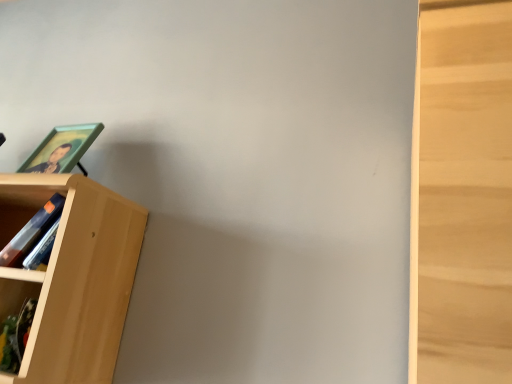
Identify the location of light wood bookcase at left. (72, 277).

This screenshot has height=384, width=512. Describe the element at coordinates (72, 277) in the screenshot. I see `light wood bookcase at left` at that location.

What do you see at coordinates (62, 149) in the screenshot? Image resolution: width=512 pixels, height=384 pixels. I see `matte green picture frame at left` at bounding box center [62, 149].

The width and height of the screenshot is (512, 384). Identify the location of matte green picture frame at left. (62, 149).

What is the approximate height of matte green picture frame at left?

18.96 centimeters.

You are a GUI agent. You are given a task and a screenshot of the screen. Output one action in this format:
    pyautogui.click(x=<x>, y=<y>)
    Task: Click on the light wood bookcase at left
    The image size is (512, 384).
    Given the screenshot: What is the action you would take?
    pyautogui.click(x=72, y=277)

Which object is positioned more to the right, light wood bookcase at left or matte green picture frame at left?

Positioned to the right is matte green picture frame at left.

Is light wood bookcase at left further to camera compared to matte green picture frame at left?

No.

Does point (106, 345) appear closer or farther from the camera than point (57, 151)?

Clearly, point (106, 345) is closer to the camera than point (57, 151).

From the image's perspective, which object appears higher, light wood bookcase at left or matte green picture frame at left?

From the image's view, matte green picture frame at left is above.

Consider the image. From a real-world perspective, is light wood bookcase at left positioned over matte green picture frame at left based on gravity?

Actually, light wood bookcase at left is physically below matte green picture frame at left in the real world.

Does light wood bookcase at left have a lesser width compared to matte green picture frame at left?

No, light wood bookcase at left is not thinner than matte green picture frame at left.

Between light wood bookcase at left and matte green picture frame at left, which one has more height?

light wood bookcase at left is taller.

Based on the photo, which of these two, light wood bookcase at left or matte green picture frame at left, is bigger?

With larger size is light wood bookcase at left.

Is light wood bookcase at left spatially inside matte green picture frame at left, or outside of it?

light wood bookcase at left is not enclosed by matte green picture frame at left.

Is light wood bookcase at left positioned far away from matte green picture frame at left?

Actually, light wood bookcase at left and matte green picture frame at left are a little close together.

Is light wood bookcase at left oriented towards matte green picture frame at left?

No.

What's the angular difference between light wood bookcase at left and matte green picture frame at left's facing directions?

2.75e-05 degrees.

How far apart are light wood bookcase at left and matte green picture frame at left?

light wood bookcase at left and matte green picture frame at left are 22.15 centimeters apart.

Where is `bookcase below the matte green picture frame at left (from the image's perspective)`? This screenshot has height=384, width=512. bookcase below the matte green picture frame at left (from the image's perspective) is located at coordinates (72, 277).

Which object is positioned more to the right, matte green picture frame at left or light wood bookcase at left?

matte green picture frame at left.

Considering their positions, is matte green picture frame at left located in front of or behind light wood bookcase at left?

In the image, matte green picture frame at left appears behind light wood bookcase at left.

Which is in front, point (66, 139) or point (96, 214)?

The point (96, 214) is more forward.

From the image's perspective, does matte green picture frame at left appear higher than light wood bookcase at left?

Correct, matte green picture frame at left appears higher than light wood bookcase at left in the image.

From a real-world perspective, is matte green picture frame at left physically above light wood bookcase at left?

Yes, from a real-world perspective, matte green picture frame at left is on top of light wood bookcase at left.

Which object is thinner, matte green picture frame at left or light wood bookcase at left?

With smaller width is matte green picture frame at left.

Considering the sizes of objects matte green picture frame at left and light wood bookcase at left in the image provided, who is shorter, matte green picture frame at left or light wood bookcase at left?

matte green picture frame at left is shorter.

Is matte green picture frame at left bigger than light wood bookcase at left?

No, matte green picture frame at left is not bigger than light wood bookcase at left.

Based on the photo, is light wood bookcase at left surrounded by matte green picture frame at left?

Definitely not — light wood bookcase at left is not inside matte green picture frame at left.

Is the surface of matte green picture frame at left in direct contact with light wood bookcase at left?

No, matte green picture frame at left is not touching light wood bookcase at left.

Could you tell me if matte green picture frame at left is facing light wood bookcase at left?

No, matte green picture frame at left is not facing towards light wood bookcase at left.

How many degrees apart are the facing directions of matte green picture frame at left and light wood bookcase at left?

There is a 2.75e-05-degree angle between the facing directions of matte green picture frame at left and light wood bookcase at left.

Image resolution: width=512 pixels, height=384 pixels. In order to click on picture frame above the light wood bookcase at left (from a real-world perspective) in this screenshot , I will do `click(62, 149)`.

Locate an element on the screen. bookcase in front of the matte green picture frame at left is located at coordinates (72, 277).

The height and width of the screenshot is (384, 512). In the image, there is a matte green picture frame at left. In order to click on bookcase below it (from a real-world perspective) in this screenshot , I will do `click(72, 277)`.